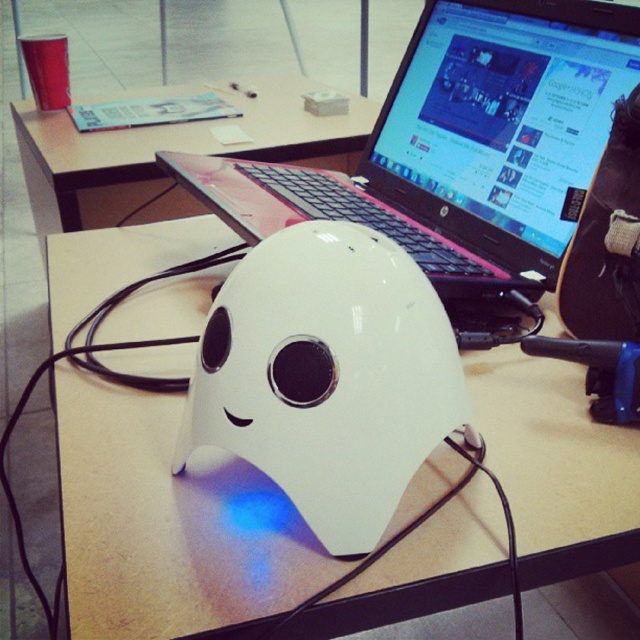
You are setting up a new workspace and need to place a white glossy mouse at center. According to the image, where should you position it relative to the desk?

The white glossy mouse at center should be positioned at the coordinates point (326, 376) on the desk according to the image.

You are organizing your desk and want to place a new object between the pink plastic laptop at center and the white matte table at center. Considering their sizes, which object should you place closer to the edge of the desk to ensure there is enough space?

The pink plastic laptop at center has a lesser width compared to the white matte table at center, so you should place the pink plastic laptop at center closer to the edge to leave more space for the wider table.

You are standing in front of the desk and want to place a small object on the desk. You have two options to choose from, either placing it at point (401, 204) or point (147, 209). Which point is closer to you?

Point (401, 204) is closer to the viewer than point (147, 209), so you should place the object there if you want it nearer to you.